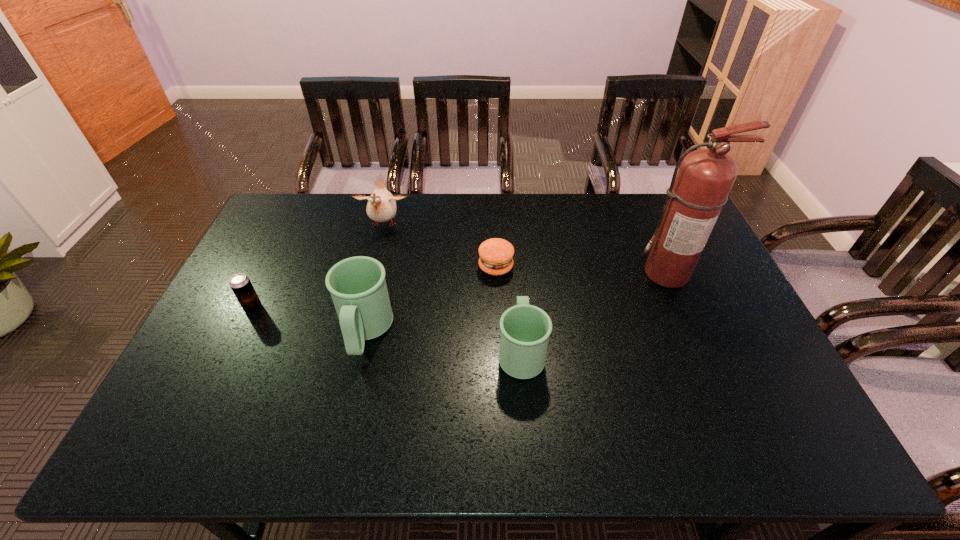
Identify the location of vacant area situated on the side of the shorter mug with the handle. (515, 273).

This screenshot has height=540, width=960. What are the coordinates of `free space located on the side of the shorter mug with the handle` in the screenshot? It's located at (516, 298).

The image size is (960, 540). I want to click on vacant space located at the beak of the farthest object, so click(366, 298).

You are a GUI agent. You are given a task and a screenshot of the screen. Output one action in this format:
    pyautogui.click(x=<x>, y=<y>)
    Task: Click on the vacant space situated 0.210m on the front-facing side of the tallest object
    The height and width of the screenshot is (540, 960).
    Given the screenshot: What is the action you would take?
    pyautogui.click(x=699, y=346)

You are a GUI agent. You are given a task and a screenshot of the screen. Output one action in this format:
    pyautogui.click(x=<x>, y=<y>)
    Task: Click on the free space located 0.320m on the right of the patty
    The width and height of the screenshot is (960, 540).
    Given the screenshot: What is the action you would take?
    pyautogui.click(x=612, y=267)

You are a GUI agent. You are given a task and a screenshot of the screen. Output one action in this format:
    pyautogui.click(x=<x>, y=<y>)
    Task: Click on the vacant region located on the front of the second shortest object
    This screenshot has height=540, width=960.
    Given the screenshot: What is the action you would take?
    pyautogui.click(x=204, y=409)

This screenshot has height=540, width=960. I want to click on object present at the far edge, so click(x=381, y=207).

Locate an element on the screen. object that is at the near edge is located at coordinates (525, 329).

Where is `object present at the left edge`? The height and width of the screenshot is (540, 960). object present at the left edge is located at coordinates (240, 284).

You are a GUI agent. You are given a task and a screenshot of the screen. Output one action in this format:
    pyautogui.click(x=<x>, y=<y>)
    Task: Click on the object present at the right edge
    Image resolution: width=960 pixels, height=540 pixels.
    Given the screenshot: What is the action you would take?
    pyautogui.click(x=698, y=192)